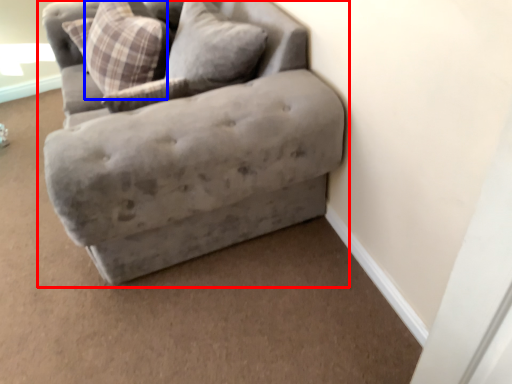
Question: Among these objects, which one is farthest to the camera, studio couch (highlighted by a red box) or pillow (highlighted by a blue box)?

Choices:
 (A) studio couch
 (B) pillow

Answer: (B)